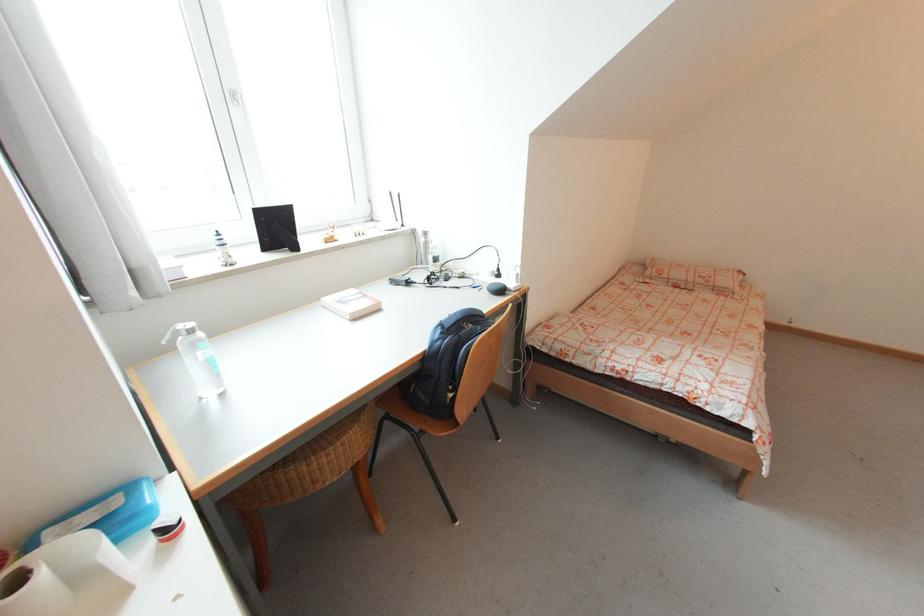
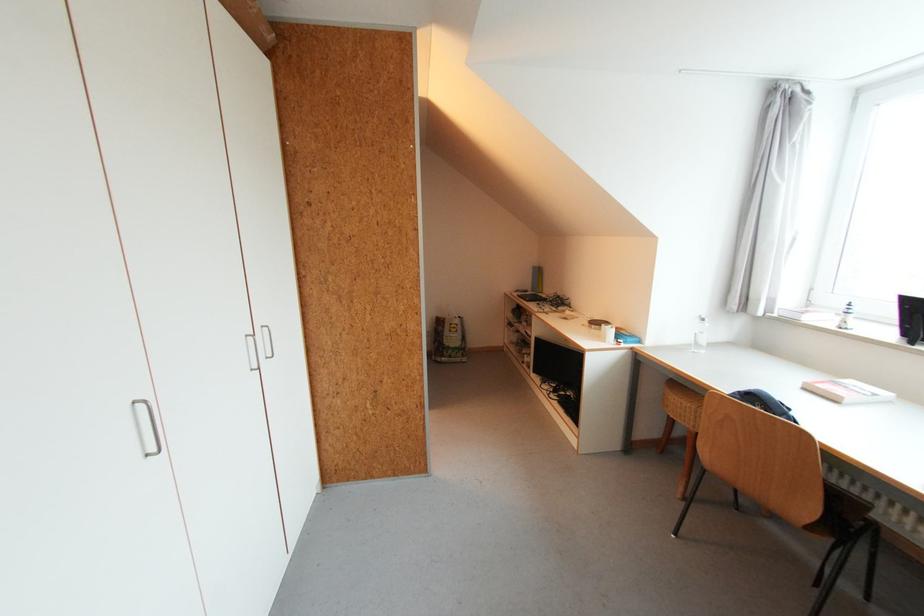
In the second image, find the point that corresponds to [383,310] in the first image.

(841, 403)